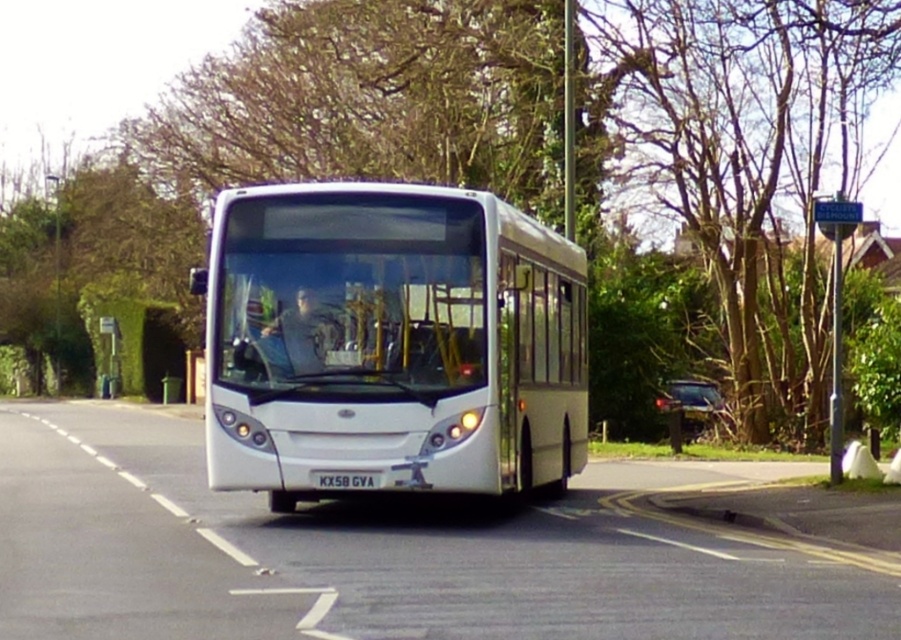
Question: Is white metallic bus at center wider than black plastic license plate at center?

Choices:
 (A) yes
 (B) no

Answer: (B)

Question: Among these points, which one is farthest from the camera?

Choices:
 (A) (810, 433)
 (B) (376, 474)
 (C) (266, 445)

Answer: (A)

Question: Which of these objects is positioned closest to the white metallic bus at center?

Choices:
 (A) green leafy tree at center
 (B) black plastic license plate at center

Answer: (B)

Question: Is the position of green leafy tree at center less distant than that of white metallic bus at center?

Choices:
 (A) no
 (B) yes

Answer: (A)

Question: In this image, where is green leafy tree at center located relative to white metallic bus at center?

Choices:
 (A) above
 (B) below

Answer: (A)

Question: Estimate the real-world distances between objects in this image. Which object is farther from the green leafy tree at center?

Choices:
 (A) white metallic bus at center
 (B) black plastic license plate at center

Answer: (A)